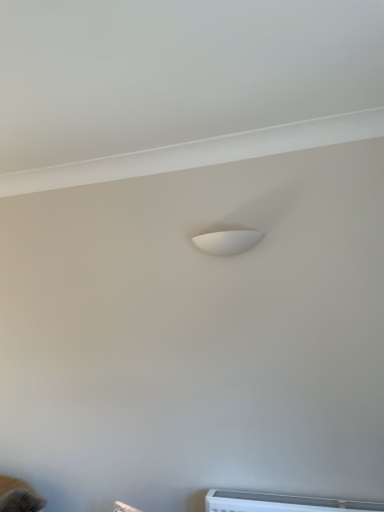
What is the approximate width of white matte lamp at center?

white matte lamp at center is 12.68 centimeters wide.

What do you see at coordinates (227, 241) in the screenshot?
I see `white matte lamp at center` at bounding box center [227, 241].

Locate an element on the screen. This screenshot has height=512, width=384. white matte lamp at center is located at coordinates (227, 241).

This screenshot has width=384, height=512. Identify the location of white matte lamp at center. (227, 241).